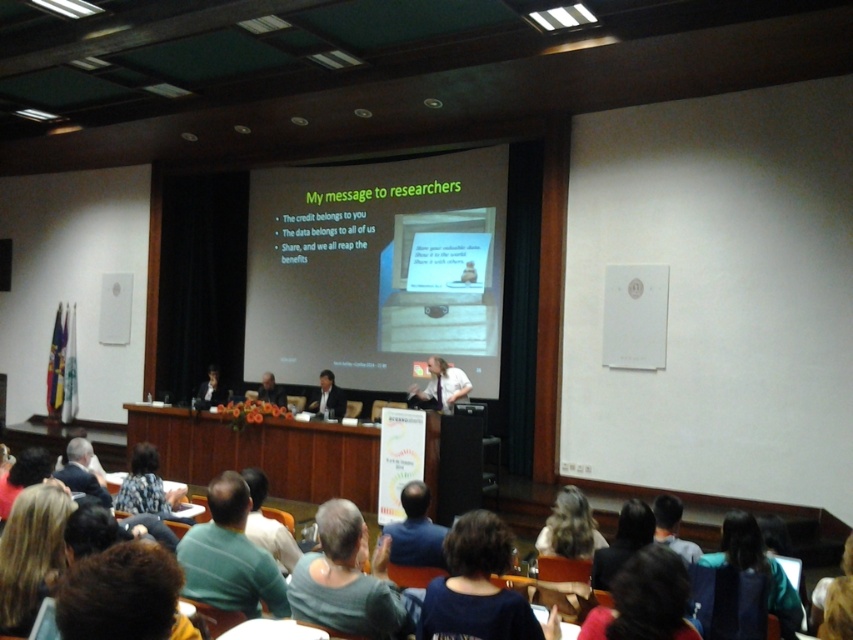
Question: Does dark blue fabric at center have a lesser width compared to dark hair at lower center?

Choices:
 (A) no
 (B) yes

Answer: (A)

Question: Does brown hair at lower left appear under black hair at lower center?

Choices:
 (A) no
 (B) yes

Answer: (A)

Question: Which of the following is the closest to the observer?

Choices:
 (A) dark brown hair at lower left
 (B) fluffy fabric sweater at lower left

Answer: (A)

Question: Estimate the real-world distances between objects in this image. Which object is closer to the dark green fabric at lower right?

Choices:
 (A) black hair at lower center
 (B) dark blue fabric at center

Answer: (A)

Question: Is dark brown hair at lower left to the right of blonde hair at center from the viewer's perspective?

Choices:
 (A) no
 (B) yes

Answer: (A)

Question: Which is farther from the dark hair at lower center?

Choices:
 (A) matte white projector screen at center
 (B) light brown hair at lower center

Answer: (A)